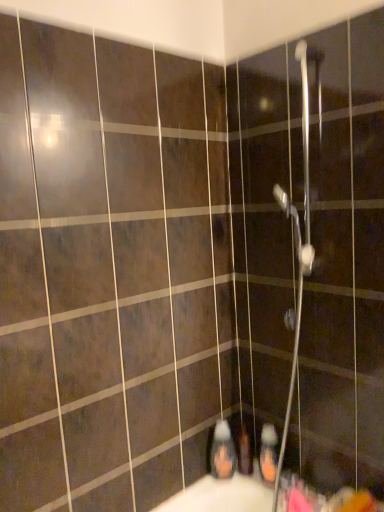
Question: Which direction should I rotate to look at matte plastic toothbrush at lower center, placed as the 2th toiletry when sorted from left to right?

Choices:
 (A) left
 (B) right

Answer: (B)

Question: Is translucent plastic soap dispenser at lower center, placed as the third toiletry when sorted from right to left, further to the viewer compared to matte plastic toothbrush at lower center, placed as the 2th toiletry when sorted from left to right?

Choices:
 (A) yes
 (B) no

Answer: (B)

Question: Does translucent plastic soap dispenser at lower center, which is the 1th toiletry in left-to-right order, have a smaller size compared to matte plastic toothbrush at lower center, which is the second toiletry in right-to-left order?

Choices:
 (A) yes
 (B) no

Answer: (B)

Question: Considering the relative sizes of translucent plastic soap dispenser at lower center, placed as the third toiletry when sorted from right to left, and matte plastic toothbrush at lower center, placed as the 2th toiletry when sorted from left to right, in the image provided, is translucent plastic soap dispenser at lower center, placed as the third toiletry when sorted from right to left, taller than matte plastic toothbrush at lower center, placed as the 2th toiletry when sorted from left to right,?

Choices:
 (A) no
 (B) yes

Answer: (B)

Question: From a real-world perspective, is translucent plastic soap dispenser at lower center, which is the 1th toiletry in left-to-right order, physically below matte plastic toothbrush at lower center, which is the second toiletry in right-to-left order?

Choices:
 (A) no
 (B) yes

Answer: (A)

Question: Is translucent plastic soap dispenser at lower center, which is the 1th toiletry in left-to-right order, facing towards matte plastic toothbrush at lower center, which is the second toiletry in right-to-left order?

Choices:
 (A) yes
 (B) no

Answer: (B)

Question: From the image's perspective, does translucent plastic soap dispenser at lower center, which is the 1th toiletry in left-to-right order, appear higher than matte plastic toothbrush at lower center, which is the second toiletry in right-to-left order?

Choices:
 (A) yes
 (B) no

Answer: (A)

Question: From the image's perspective, does orange matte bottle at lower center, which is the 3th toiletry in left-to-right order, appear lower than matte plastic toothbrush at lower center, placed as the 2th toiletry when sorted from left to right?

Choices:
 (A) yes
 (B) no

Answer: (B)

Question: Is orange matte bottle at lower center, the 1th toiletry viewed from the right, oriented towards matte plastic toothbrush at lower center, placed as the 2th toiletry when sorted from left to right?

Choices:
 (A) no
 (B) yes

Answer: (A)

Question: Could matte plastic toothbrush at lower center, placed as the 2th toiletry when sorted from left to right, be considered to be inside orange matte bottle at lower center, the 1th toiletry viewed from the right?

Choices:
 (A) no
 (B) yes

Answer: (A)

Question: Is orange matte bottle at lower center, which is the 3th toiletry in left-to-right order, looking in the opposite direction of matte plastic toothbrush at lower center, placed as the 2th toiletry when sorted from left to right?

Choices:
 (A) yes
 (B) no

Answer: (B)

Question: Can you confirm if orange matte bottle at lower center, which is the 3th toiletry in left-to-right order, is positioned to the right of matte plastic toothbrush at lower center, placed as the 2th toiletry when sorted from left to right?

Choices:
 (A) no
 (B) yes

Answer: (B)

Question: From the image's perspective, is orange matte bottle at lower center, which is the 3th toiletry in left-to-right order, located above matte plastic toothbrush at lower center, which is the second toiletry in right-to-left order?

Choices:
 (A) yes
 (B) no

Answer: (A)

Question: From a real-world perspective, is orange matte bottle at lower center, which is the 3th toiletry in left-to-right order, physically below metallic silver shower head at upper center?

Choices:
 (A) no
 (B) yes

Answer: (B)